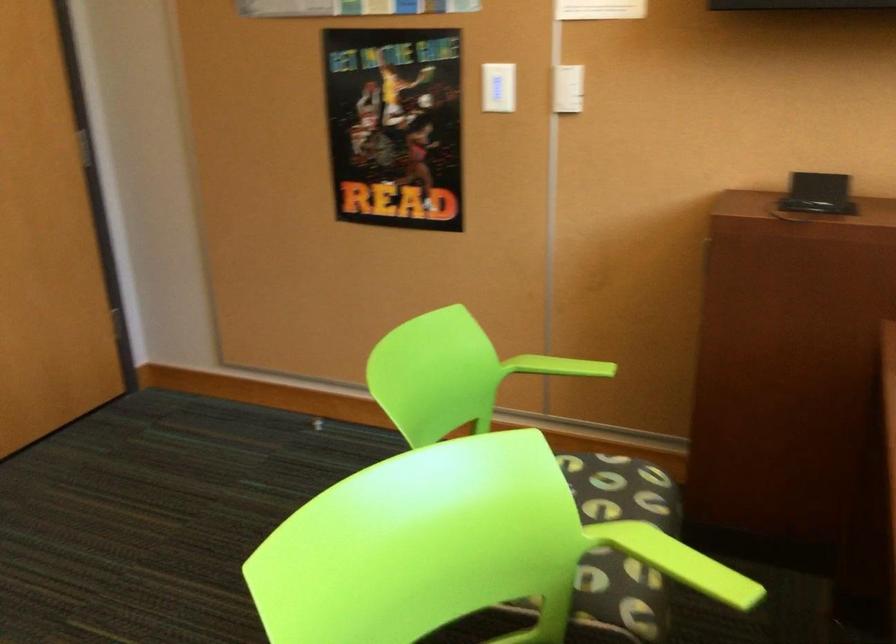
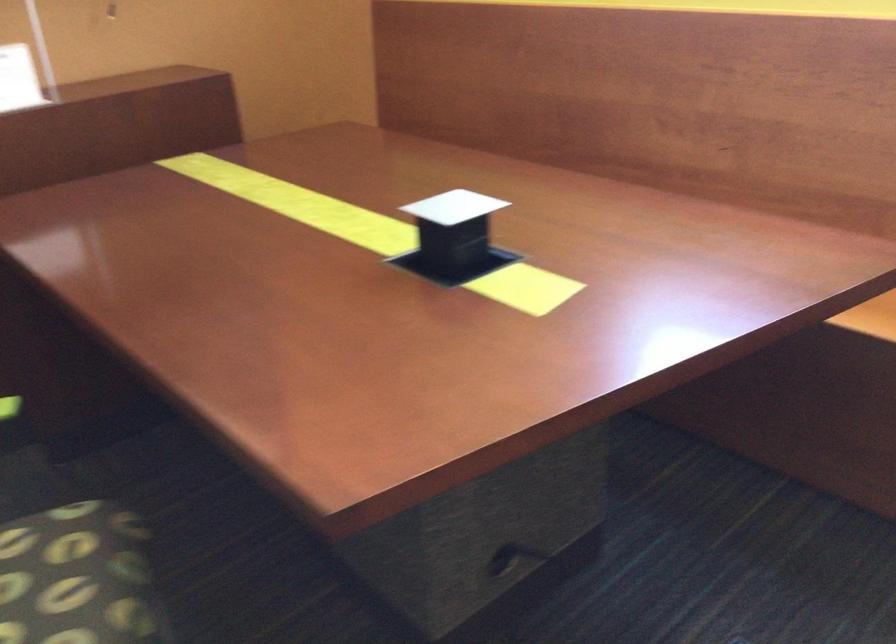
Based on the continuous images, in which direction is the camera rotating?

The camera's rotation is toward right-down.